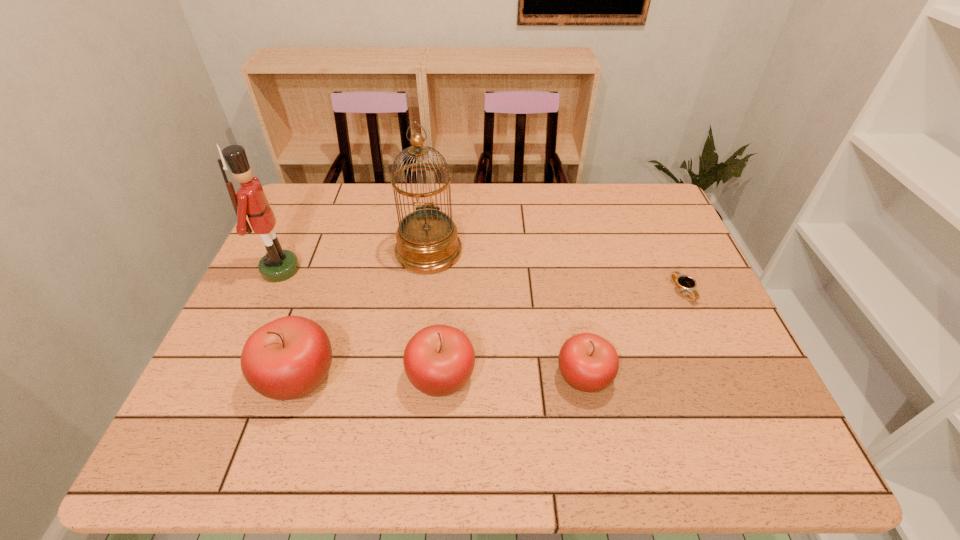
At what (x,y) coordinates should I click in order to perform the action: click on the second object from left to right. Please return your answer as a coordinate pair (x, y). Looking at the image, I should click on (288, 358).

Identify the location of the second shortest apple. (439, 360).

The width and height of the screenshot is (960, 540). Find the location of `the third shortest object`. the third shortest object is located at coordinates (439, 360).

Where is `the shortest apple`? the shortest apple is located at coordinates (589, 363).

At what (x,y) coordinates should I click in order to perform the action: click on the second object from right to left. Please return your answer as a coordinate pair (x, y). The width and height of the screenshot is (960, 540). Looking at the image, I should click on (589, 363).

The image size is (960, 540). In order to click on birdcage in this screenshot , I will do `click(427, 242)`.

Identify the location of the leftmost object. The width and height of the screenshot is (960, 540). (277, 265).

What are the coordinates of `the shortest object` in the screenshot? It's located at (682, 282).

Identify the location of watch. The height and width of the screenshot is (540, 960). (682, 282).

The width and height of the screenshot is (960, 540). Identify the location of blank area located 0.130m on the back of the fifth object from right to left. (324, 303).